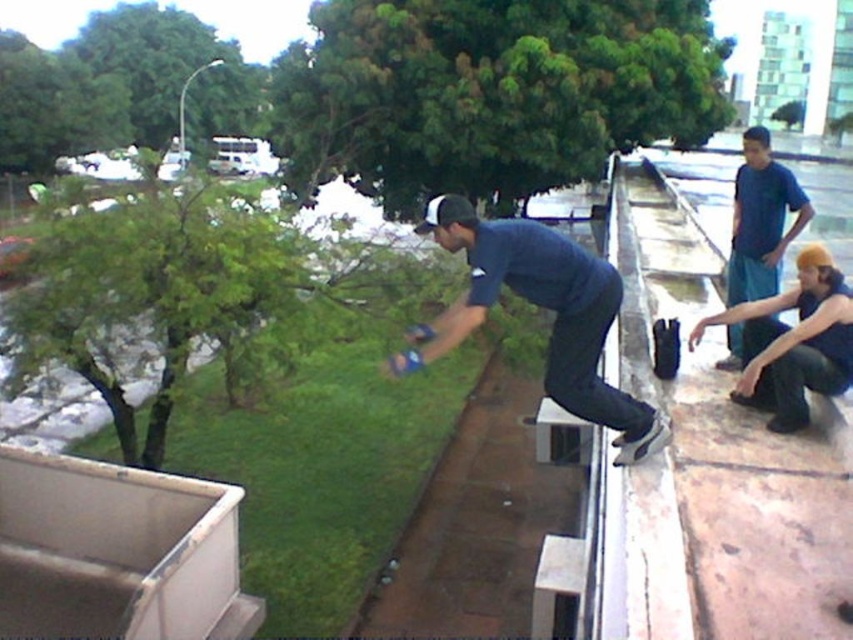
Question: Does dark blue denim jeans at center come behind blue cotton shirt at upper right?

Choices:
 (A) yes
 (B) no

Answer: (B)

Question: Among these objects, which one is farthest from the camera?

Choices:
 (A) dark blue fabric squat at lower right
 (B) blue cotton shirt at upper right

Answer: (B)

Question: Which object is positioned closest to the dark blue denim jeans at center?

Choices:
 (A) dark blue fabric squat at lower right
 (B) blue cotton shirt at upper right

Answer: (A)

Question: Which object is positioned farthest from the dark blue fabric squat at lower right?

Choices:
 (A) dark blue denim jeans at center
 (B) blue cotton shirt at upper right

Answer: (A)

Question: Is dark blue fabric squat at lower right thinner than blue cotton shirt at upper right?

Choices:
 (A) no
 (B) yes

Answer: (B)

Question: Is dark blue denim jeans at center above dark blue fabric squat at lower right?

Choices:
 (A) no
 (B) yes

Answer: (B)